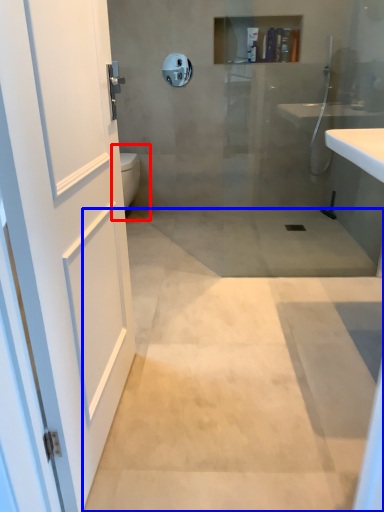
Question: Which object appears closest to the camera in this image, toilet bowl (highlighted by a red box) or concrete (highlighted by a blue box)?

Choices:
 (A) toilet bowl
 (B) concrete

Answer: (B)